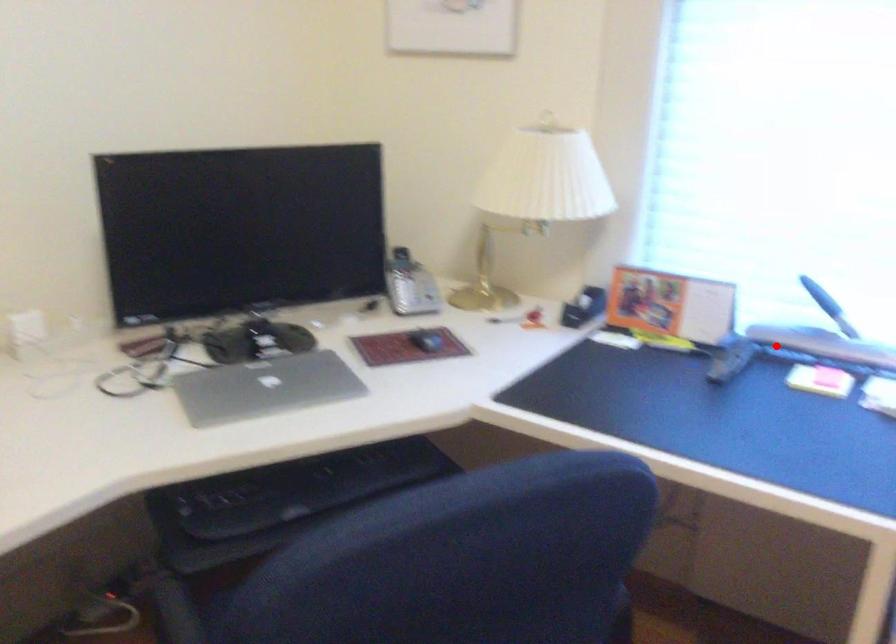
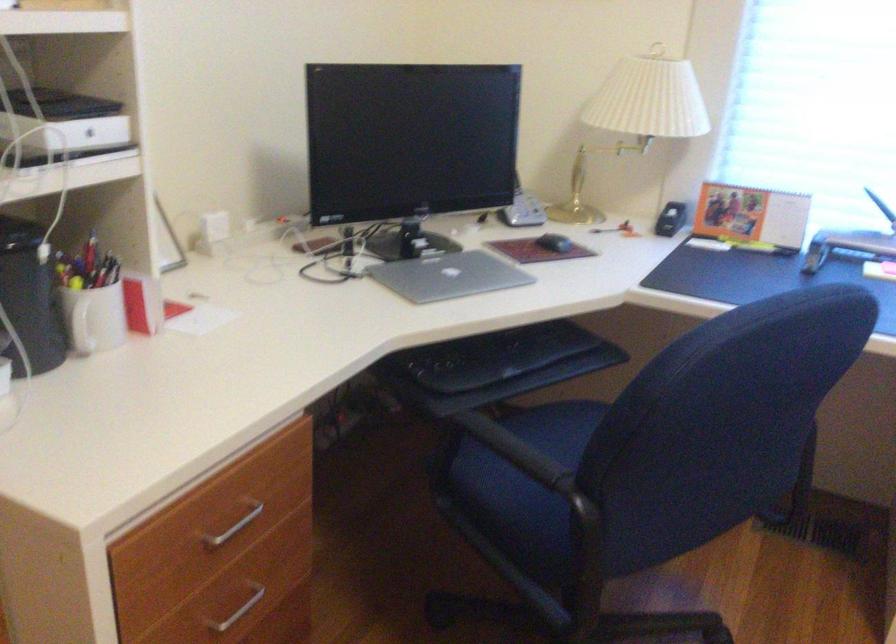
Locate, in the second image, the point that corresponds to the highlighted location in the first image.

(847, 245)